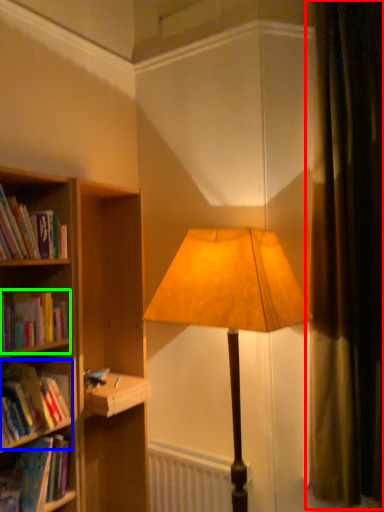
Question: Based on their relative distances, which object is nearer to curtain (highlighted by a red box)? Choose from book (highlighted by a blue box) and book (highlighted by a green box).

Choices:
 (A) book
 (B) book

Answer: (B)